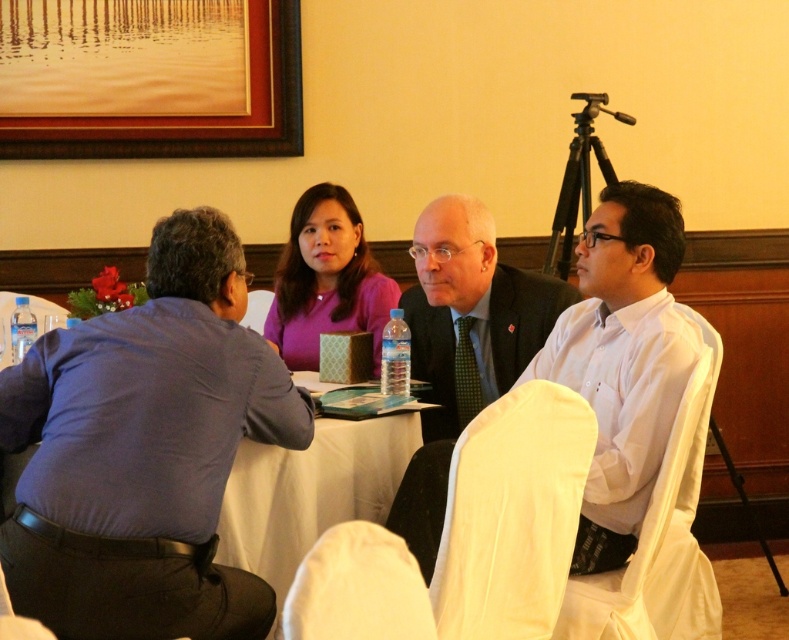
You are a guest entering the meeting room and need to sit next to the blue fabric shirt at left. Based on their positions, which direction should you choose to sit relative to the dark gray suit at center?

The blue fabric shirt at left is below the dark gray suit at center, so to sit next to the blue fabric shirt at left, you should choose a seat to the lower side relative to the dark gray suit at center.

You are standing at the center of the room and want to place a new decorative item exactly where the brown wooden picture frame at upper left is located. What are the coordinates of that spot?

The coordinates of the brown wooden picture frame at upper left are at point (148, 77).